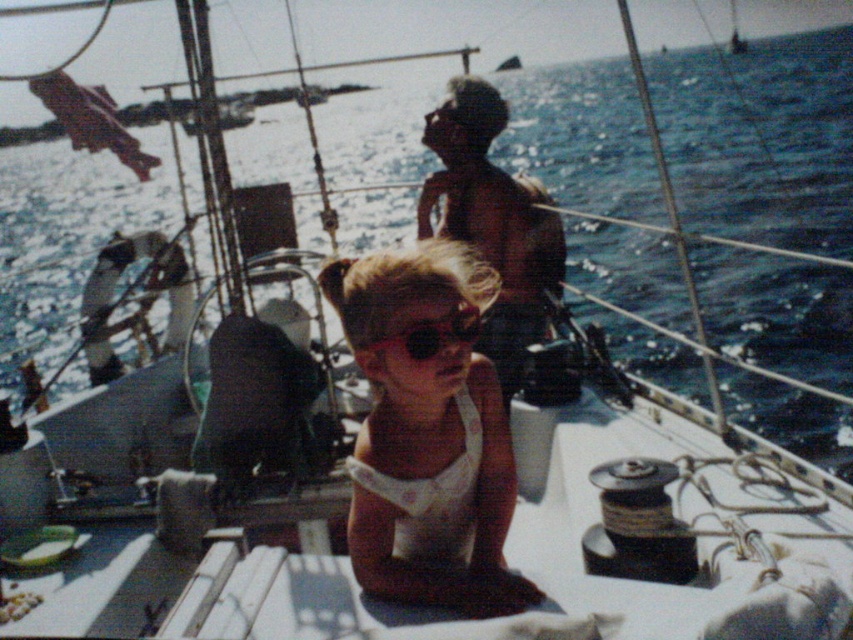
In the scene shown: You are a sailor on the deck of the boat and need to retrieve an item from the water. You notice the brown skin at upper center and the black matte goggles at center. Which object is positioned higher up relative to the other?

The brown skin at upper center is above the black matte goggles at center, so it is positioned higher up.

You are a sailor on the deck of the sailboat and need to reach both the white fabric dress at center and the black matte goggles at center. If you can only move 10 inches, can you reach both items without moving your position?

Result: The white fabric dress at center and black matte goggles at center are 10.41 inches apart. Since the distance between them is slightly more than 10 inches, you cannot reach both items without moving your position.

You are a photographer trying to capture a portrait of the person on the sailboat. You notice the white fabric dress at center and the brown skin at upper center in your frame. Which object takes up more space in the photo?

The brown skin at upper center takes up more space in the photo since the white fabric dress at center has a lesser width compared to brown skin at upper center.